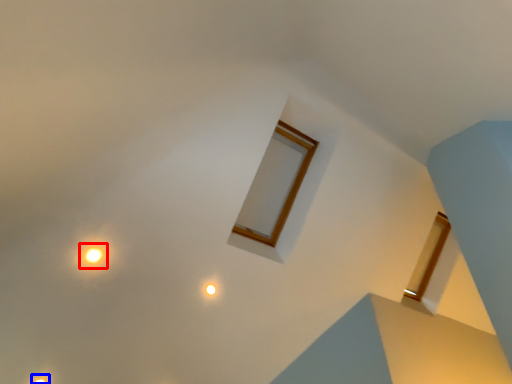
Question: Among these objects, which one is farthest to the camera, light (highlighted by a red box) or light (highlighted by a blue box)?

Choices:
 (A) light
 (B) light

Answer: (B)